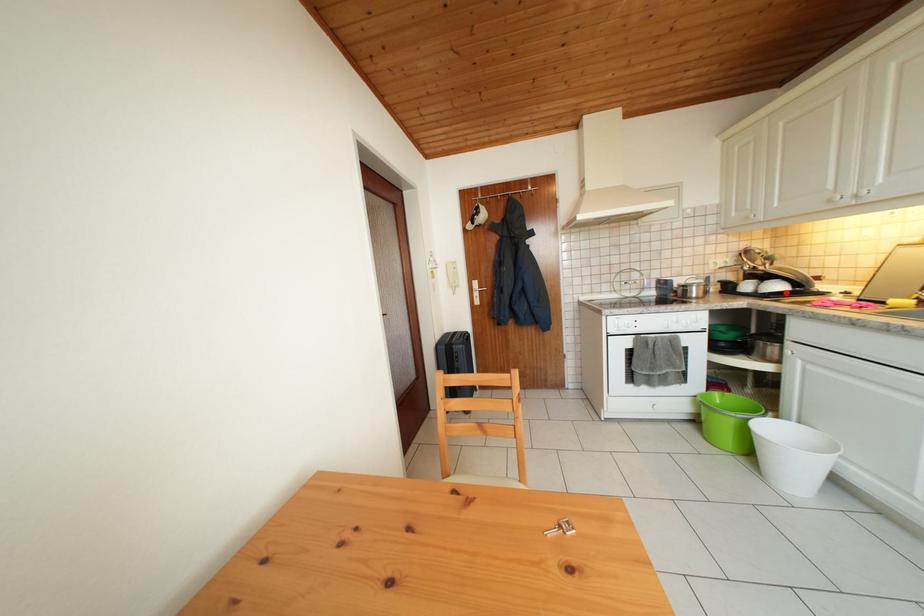
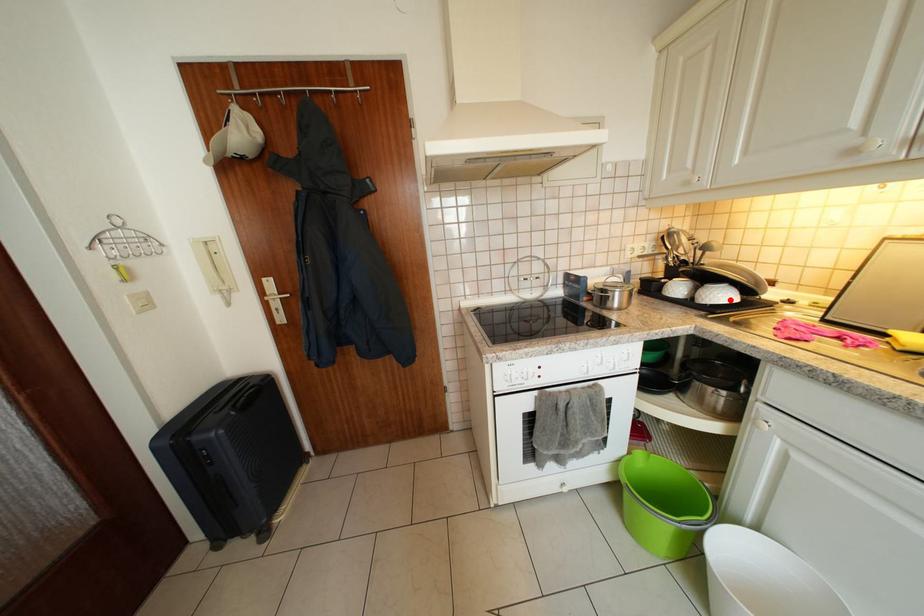
I am providing you with two images of the same scene from different viewpoints. A red point is marked on the first image and another point is marked on the second image. Are the points marked in image1 and image2 representing the same 3D position?

Yes